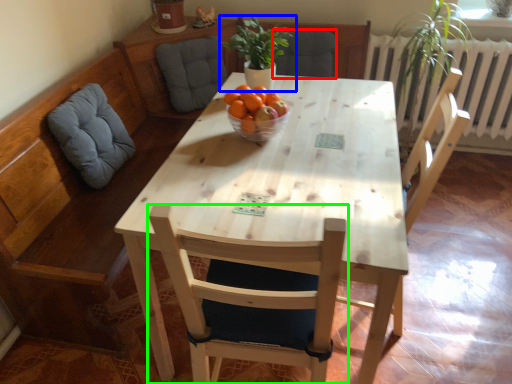
Question: Considering the real-world distances, which object is closest to armchair (highlighted by a red box)? houseplant (highlighted by a blue box) or chair (highlighted by a green box).

Choices:
 (A) houseplant
 (B) chair

Answer: (A)